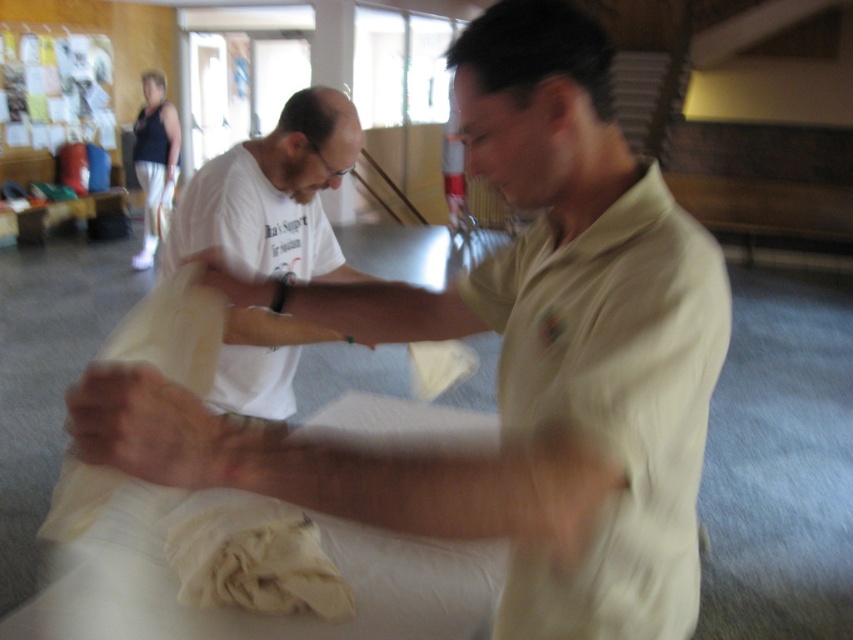
You are a photographer setting up for a martial arts demonstration. You need to ensure that the white cotton shirt at center and the white fabric at center are both visible in your shot. Given their positions, which object should you focus on first to capture both in frame?

The white cotton shirt at center has a greater height compared to the white fabric at center, so focusing on the taller white cotton shirt at center first will ensure both are visible in the frame.

You are a photographer positioned at the entrance of the dojo. You need to take a photo that includes both the white cotton shirt at center and the white fabric at center. Which object should you adjust your focus on first to ensure both are in the frame?

The white cotton shirt at center is closer to you than the white fabric at center, so you should focus on the white cotton shirt at center first to ensure both are in the frame.